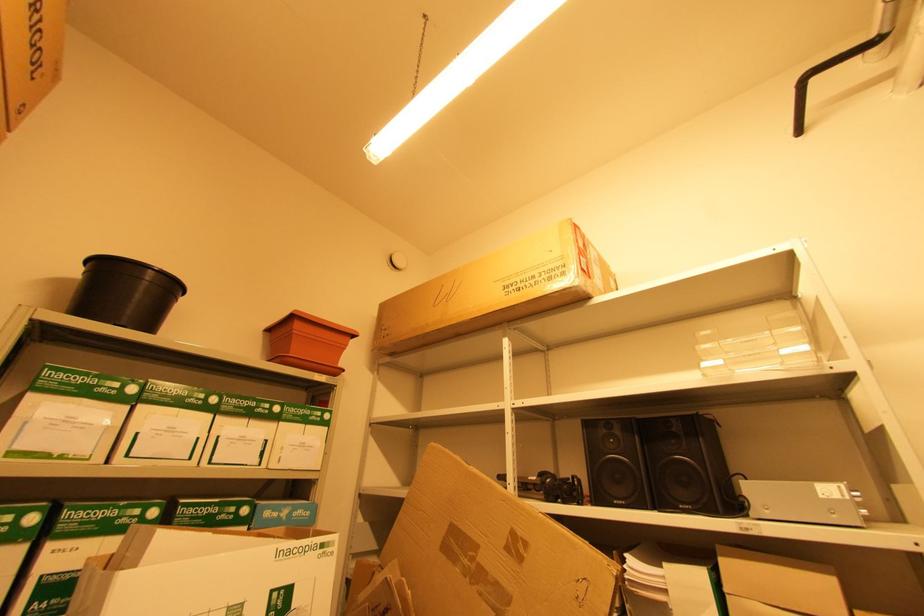
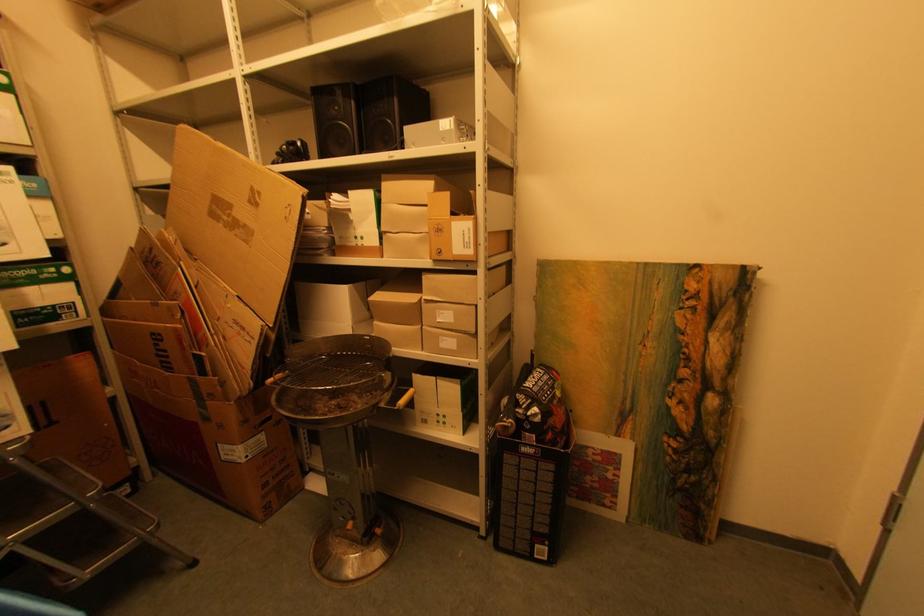
First-person continuous shooting, in which direction is the camera rotating?

The camera's rotation is toward right-down.